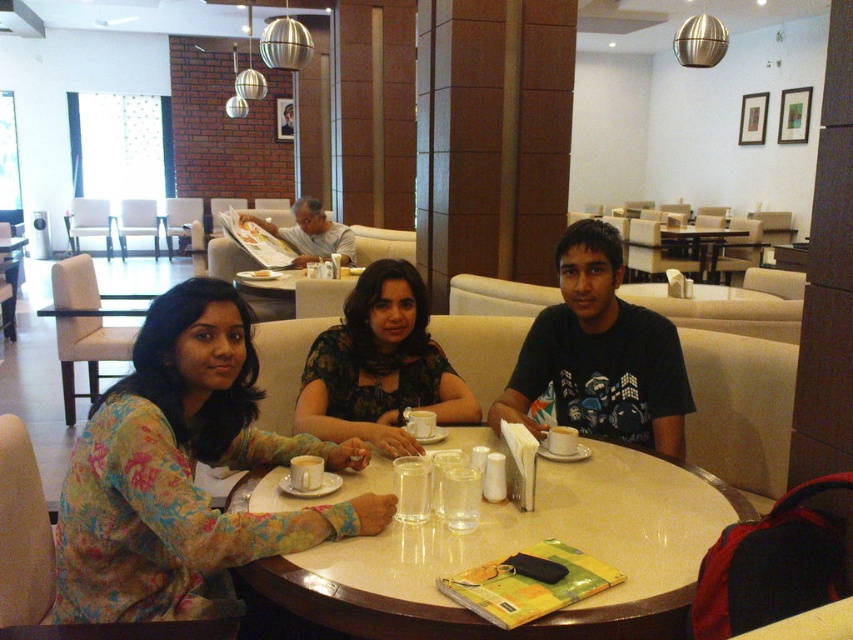
Can you confirm if floral print dress at center is positioned to the right of marble table at center?

Incorrect, floral print dress at center is not on the right side of marble table at center.

The width and height of the screenshot is (853, 640). Describe the element at coordinates (184, 474) in the screenshot. I see `floral print dress at center` at that location.

Who is more distant from viewer, (x=91, y=452) or (x=666, y=502)?

Point (x=666, y=502)

Image resolution: width=853 pixels, height=640 pixels. I want to click on floral print dress at center, so click(x=184, y=474).

Does black cotton t-shirt at center come behind floral fabric dress at center?

Yes, black cotton t-shirt at center is further from the viewer.

Between point (677, 419) and point (401, 454), which one is positioned in front?

Point (401, 454) is in front.

I want to click on black cotton t-shirt at center, so click(601, 355).

In the scene shown: Does floral print dress at center have a lesser width compared to smooth wooden table at center?

Yes, floral print dress at center is thinner than smooth wooden table at center.

Between floral print dress at center and smooth wooden table at center, which one appears on the right side from the viewer's perspective?

smooth wooden table at center is more to the right.

Identify the location of floral print dress at center. (184, 474).